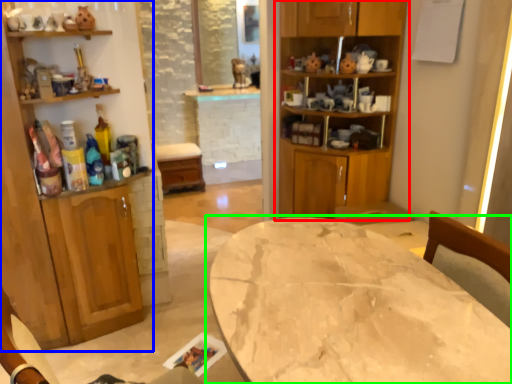
Question: Which object is positioned closest to cabinetry (highlighted by a red box)? Select from cabinetry (highlighted by a blue box) and table (highlighted by a green box).

Choices:
 (A) cabinetry
 (B) table

Answer: (A)